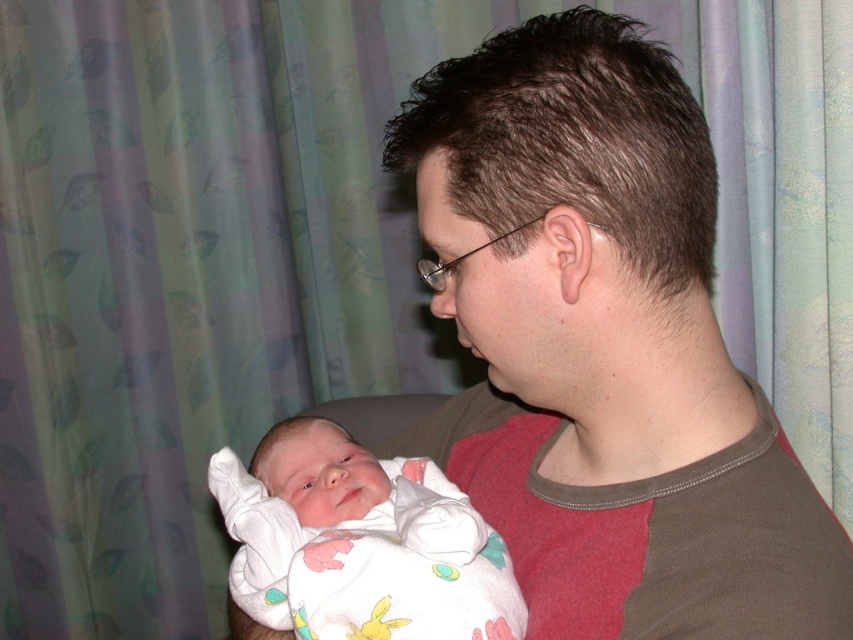
You are a photographer adjusting your camera to focus on two specific points in the image. The first point is at coordinates point (711, 259) and the second point is at coordinates point (498, 550). Which point should you focus on first if you want to capture the closest object in the scene?

Point (711, 259) is closer to the viewer than point (498, 550), so you should focus on point (711, 259) first to capture the closest object in the scene.

You are standing in the room and want to reach the point at coordinates (409, 172). If you take two steps forward, each step covering 2.5 feet, will you be able to reach that point?

The point at coordinates (409, 172) is 5.25 feet away. Taking two steps of 2.5 feet each would cover 5 feet total. Since 5 feet is less than 5.25 feet, you will not quite reach the point after two steps.